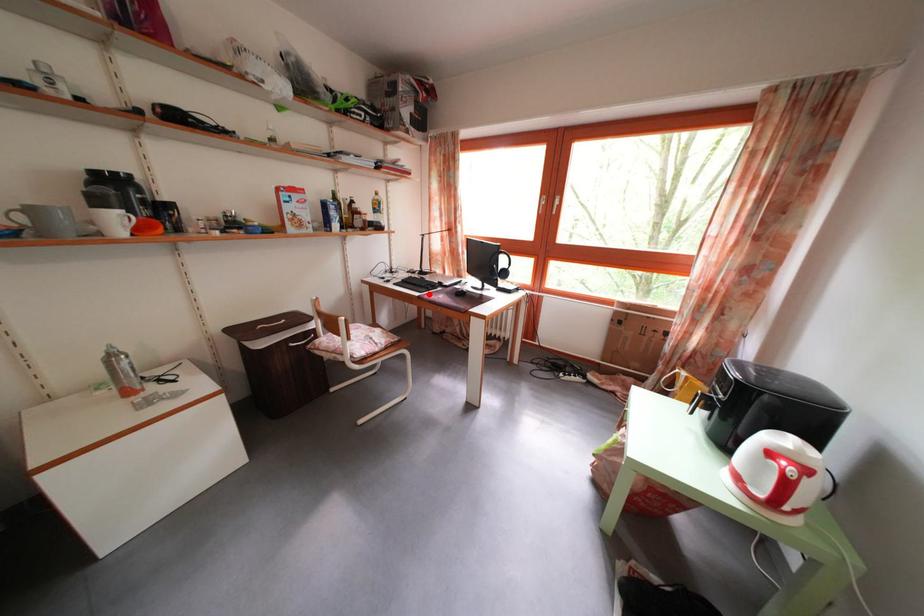
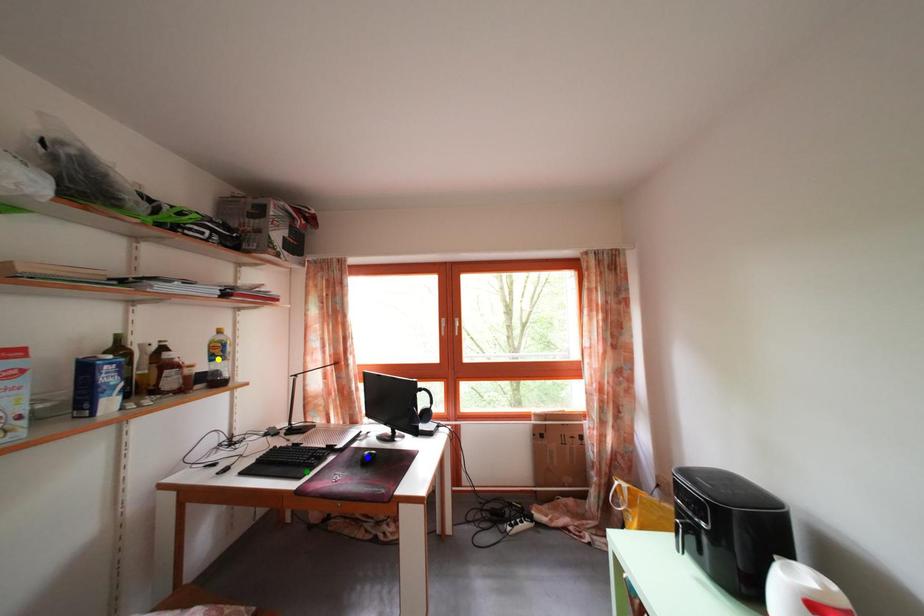
Question: I am providing you with two images of the same scene from different viewpoints. A red point is marked on the first image. You are given multiple points on the second image. Which mark in image 2 goes with the point in image 1?

Choices:
 (A) yellow point
 (B) green point
 (C) blue point

Answer: (B)